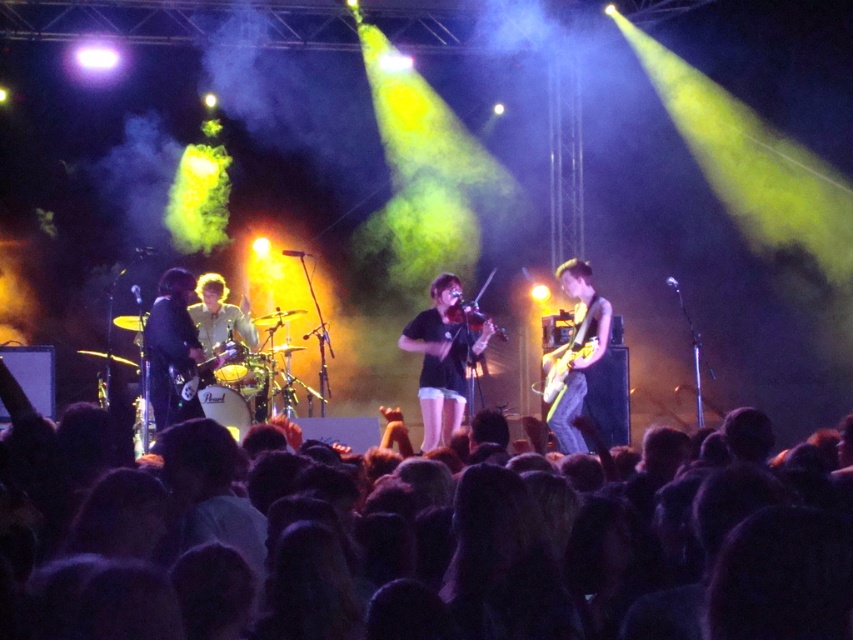
You are a photographer at the concert and want to focus on two specific points in the image, point 1 at location (432, 394) and point 2 at (546, 360). Which point is closer to your camera lens?

Point 1 at location (432, 394) is closer to the viewer than point 2 at (546, 360).

You are a stagehand needing to place a 30 inch long banner between the shiny black guitar at center and the wooden violin at center. Can you fit it there?

The distance between the shiny black guitar at center and the wooden violin at center is 27.47 inches. Since the banner is 30 inches long, it cannot fit between them as the space is shorter than the banner.

You are a stagehand responsible for arranging musical instruments. You need to place a large amplifier next to the black matte violin at center and the glossy electric guitar at center. Which instrument should you place the amplifier closer to if the amplifier is designed for larger instruments?

The amplifier should be placed closer to the black matte violin at center because it has a larger size compared to the glossy electric guitar at center, making it more suitable for a larger amplifier.